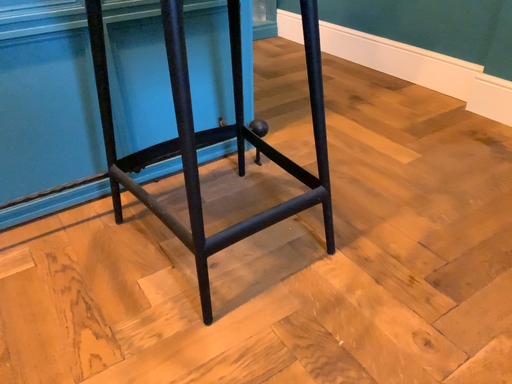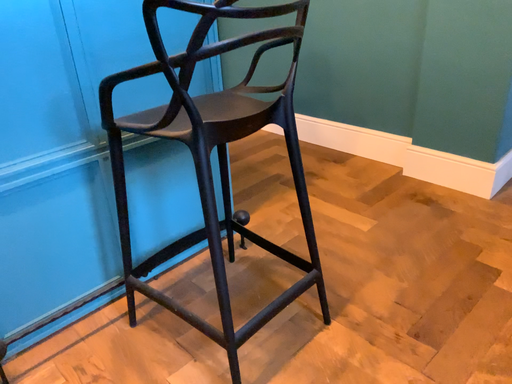
Question: Which way did the camera rotate in the video?

Choices:
 (A) rotated left
 (B) rotated right

Answer: (B)